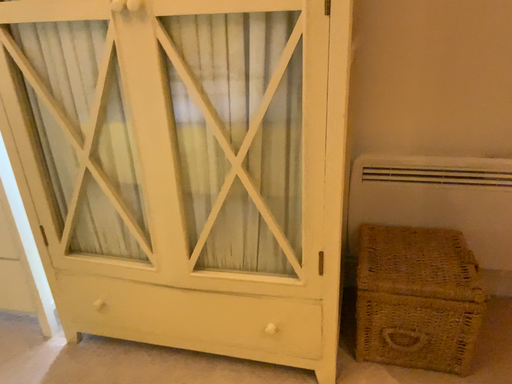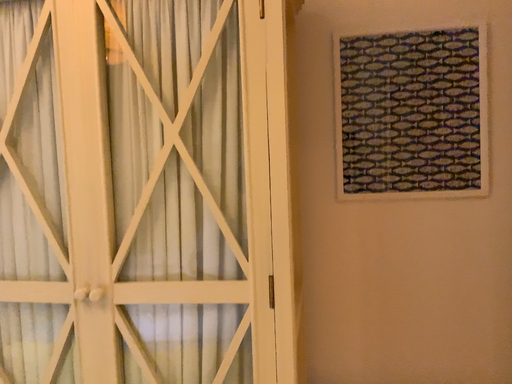
Question: How did the camera likely rotate when shooting the video?

Choices:
 (A) rotated upward
 (B) rotated downward

Answer: (A)